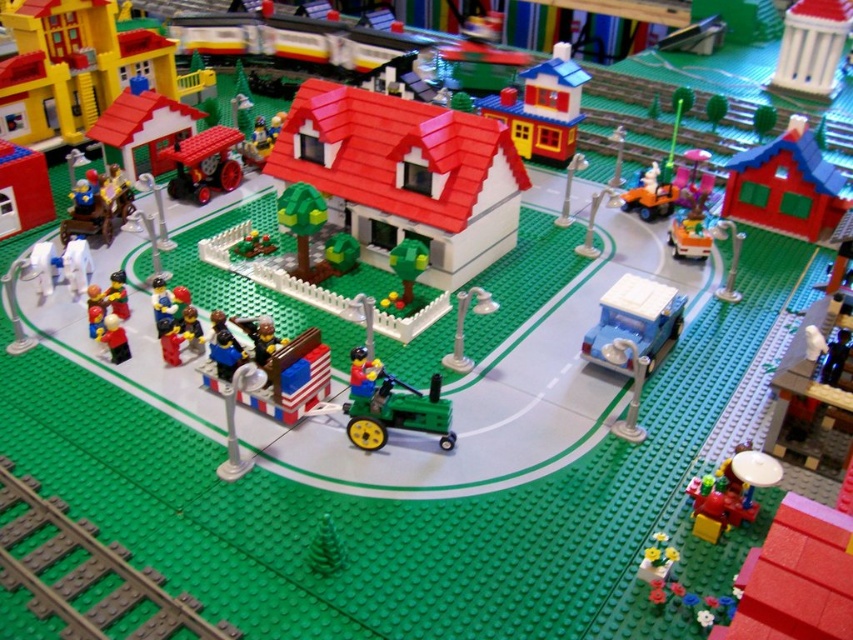
Question: Can you confirm if green plastic train track at bottom left is wider than smooth plastic figure at lower left?

Choices:
 (A) yes
 (B) no

Answer: (A)

Question: Which point appears closest to the camera in this image?

Choices:
 (A) (770, 182)
 (B) (213, 141)
 (C) (198, 632)

Answer: (C)

Question: Does smooth plastic house at right appear on the left side of green matte tree at center?

Choices:
 (A) yes
 (B) no

Answer: (B)

Question: Which point appears farthest from the camera in this image?

Choices:
 (A) (15, 483)
 (B) (236, 166)
 (C) (119, 352)
 (D) (535, 99)

Answer: (D)

Question: Can you confirm if smooth plastic house at upper center is smaller than matte red tractor at center?

Choices:
 (A) yes
 (B) no

Answer: (B)

Question: Estimate the real-world distances between objects in this image. Which object is farther from the smooth plastic figure at lower left?

Choices:
 (A) green plastic train track at bottom left
 (B) matte red tractor at center
 (C) green matte tree at center
 (D) light blue plastic car at center-right

Answer: (D)